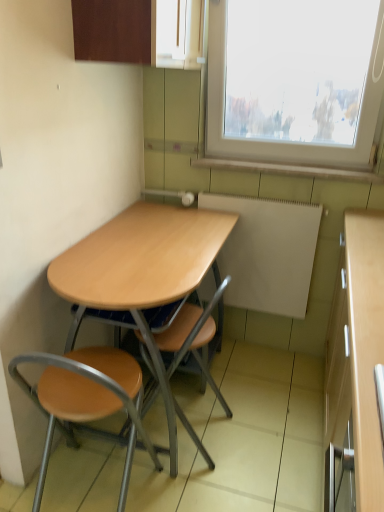
Question: From the image's perspective, is matte wood cabinet at upper center above or below white matte radiator at center?

Choices:
 (A) below
 (B) above

Answer: (B)

Question: Is matte wood cabinet at upper center bigger or smaller than white matte radiator at center?

Choices:
 (A) big
 (B) small

Answer: (A)

Question: Estimate the real-world distances between objects in this image. Which object is closer to the wooden seat at center, which is the first chair from right to left?

Choices:
 (A) wooden table at center
 (B) green tile at upper right
 (C) matte wood cabinet at upper center
 (D) wooden seat at lower left, the second chair in the right-to-left sequence
 (E) white matte radiator at center

Answer: (A)

Question: Considering the real-world distances, which object is closest to the wooden seat at center, placed as the second chair when sorted from left to right?

Choices:
 (A) matte wood cabinet at upper center
 (B) wooden table at center
 (C) wooden seat at lower left, the second chair in the right-to-left sequence
 (D) green tile at upper right
 (E) white matte radiator at center

Answer: (B)